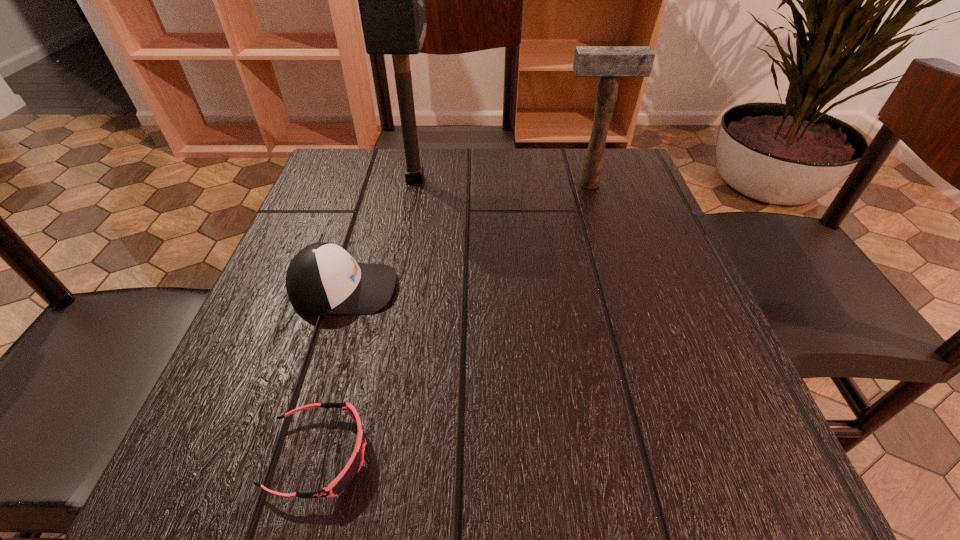
Where is `the tallest object`? The height and width of the screenshot is (540, 960). the tallest object is located at coordinates coord(391,0).

This screenshot has width=960, height=540. Identify the location of the taller mallet. (391, 0).

At what (x,y) coordinates should I click in order to perform the action: click on the third shortest object. Please return your answer as a coordinate pair (x, y). The width and height of the screenshot is (960, 540). Looking at the image, I should click on (610, 63).

Identify the location of the rightmost object. (610, 63).

Locate an element on the screen. the second nearest object is located at coordinates (322, 278).

Find the location of a particular element. The width and height of the screenshot is (960, 540). cap is located at coordinates (322, 278).

I want to click on goggles, so click(x=354, y=464).

Identify the location of the shortest object. The image size is (960, 540). (354, 464).

The image size is (960, 540). I want to click on vacant region located 0.170m on the left of the tallest object, so click(x=321, y=179).

The height and width of the screenshot is (540, 960). I want to click on vacant space positioned on the front of the right mallet, so click(x=599, y=217).